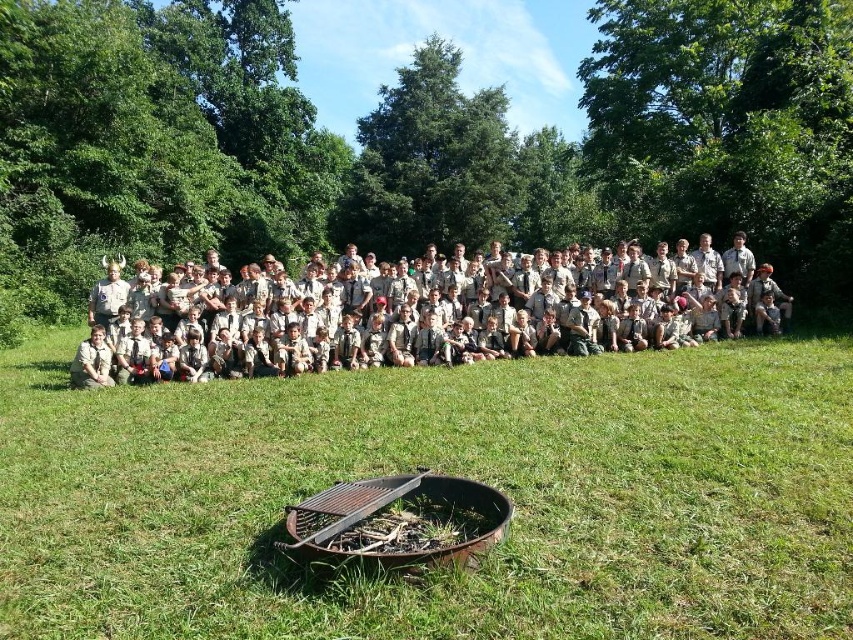
Can you confirm if tan uniform at center is positioned to the right of black metal fire pit at lower center?

No, tan uniform at center is not to the right of black metal fire pit at lower center.

Describe the element at coordinates (426, 330) in the screenshot. This screenshot has height=640, width=853. I see `tan uniform at center` at that location.

Image resolution: width=853 pixels, height=640 pixels. I want to click on tan uniform at center, so click(x=426, y=330).

Between green grass at center and black metal fire pit at lower center, which one has less height?

black metal fire pit at lower center is shorter.

Based on the photo, can you confirm if green grass at center is positioned above black metal fire pit at lower center?

Yes.

Describe the element at coordinates (445, 472) in the screenshot. Image resolution: width=853 pixels, height=640 pixels. I see `green grass at center` at that location.

At what (x,y) coordinates should I click in order to perform the action: click on green grass at center. Please return your answer as a coordinate pair (x, y). The width and height of the screenshot is (853, 640). Looking at the image, I should click on (445, 472).

Can you confirm if green grass at center is positioned above tan uniform at center?

Actually, green grass at center is below tan uniform at center.

Who is lower down, green grass at center or tan uniform at center?

green grass at center is below.

Who is more forward, (682, 362) or (552, 294)?

Point (682, 362)

You are a GUI agent. You are given a task and a screenshot of the screen. Output one action in this format:
    pyautogui.click(x=<x>, y=<y>)
    Task: Click on the green grass at center
    The width and height of the screenshot is (853, 640).
    Given the screenshot: What is the action you would take?
    pyautogui.click(x=445, y=472)